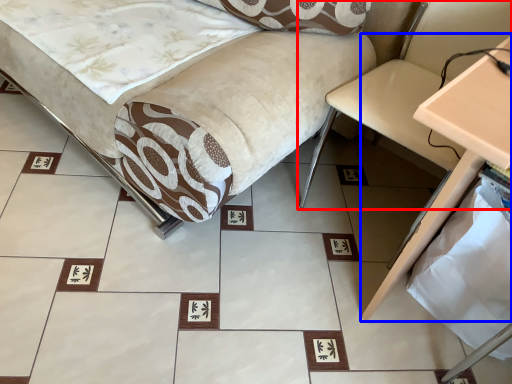
Question: Which object is further to the camera taking this photo, swivel chair (highlighted by a red box) or table (highlighted by a blue box)?

Choices:
 (A) swivel chair
 (B) table

Answer: (A)